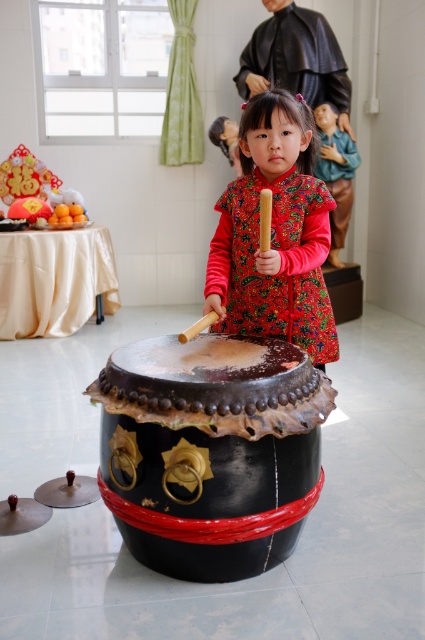
The image size is (425, 640). What do you see at coordinates (210, 451) in the screenshot?
I see `black leather drum at center` at bounding box center [210, 451].

Is point (116, 349) positioned after point (227, 230)?

No.

Between point (175, 547) and point (215, 208), which one is positioned behind?

The point (215, 208) is behind.

The height and width of the screenshot is (640, 425). I want to click on black leather drum at center, so click(210, 451).